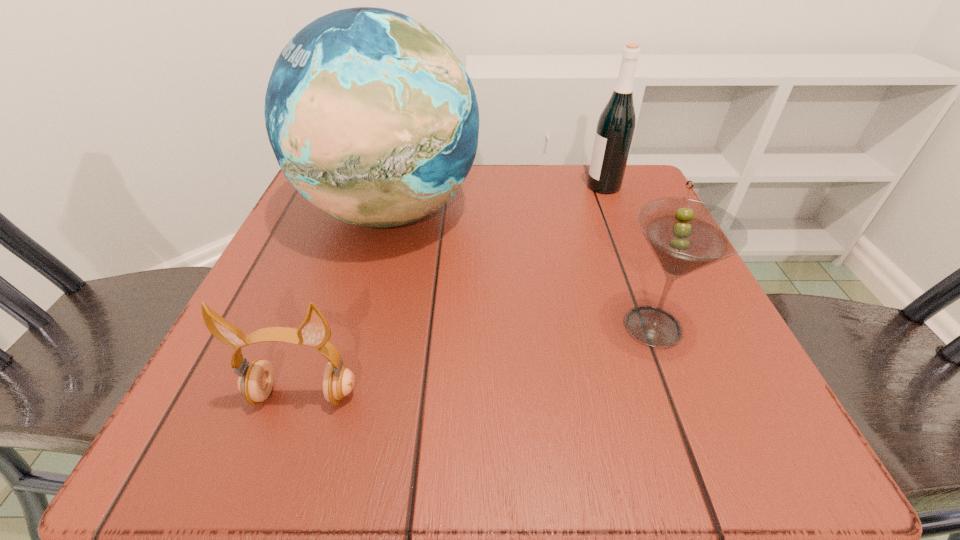
The height and width of the screenshot is (540, 960). Find the location of `vacant position located on the left of the third tallest object`. vacant position located on the left of the third tallest object is located at coordinates (444, 326).

The image size is (960, 540). Identify the location of vacant region located on the front-facing side of the earphone. (280, 461).

Identify the location of globe located in the far edge section of the desktop. (373, 119).

You are a GUI agent. You are given a task and a screenshot of the screen. Output one action in this format:
    pyautogui.click(x=<x>, y=<y>)
    Task: Click on the wine bottle located in the far edge section of the desktop
    The height and width of the screenshot is (540, 960).
    Given the screenshot: What is the action you would take?
    pyautogui.click(x=616, y=125)

At what (x,y) coordinates should I click in order to perform the action: click on object that is positioned at the near edge. Please return your answer as a coordinate pair (x, y). Looking at the image, I should click on (255, 382).

The height and width of the screenshot is (540, 960). I want to click on globe that is at the left edge, so click(373, 119).

Locate an element on the screen. The width and height of the screenshot is (960, 540). earphone that is at the left edge is located at coordinates tap(255, 382).

The image size is (960, 540). What are the coordinates of `wine bottle located in the right edge section of the desktop` in the screenshot? It's located at (616, 125).

This screenshot has height=540, width=960. What are the coordinates of `martini positioned at the right edge` in the screenshot? It's located at [x=685, y=235].

Image resolution: width=960 pixels, height=540 pixels. Identify the location of object positioned at the far left corner. (373, 119).